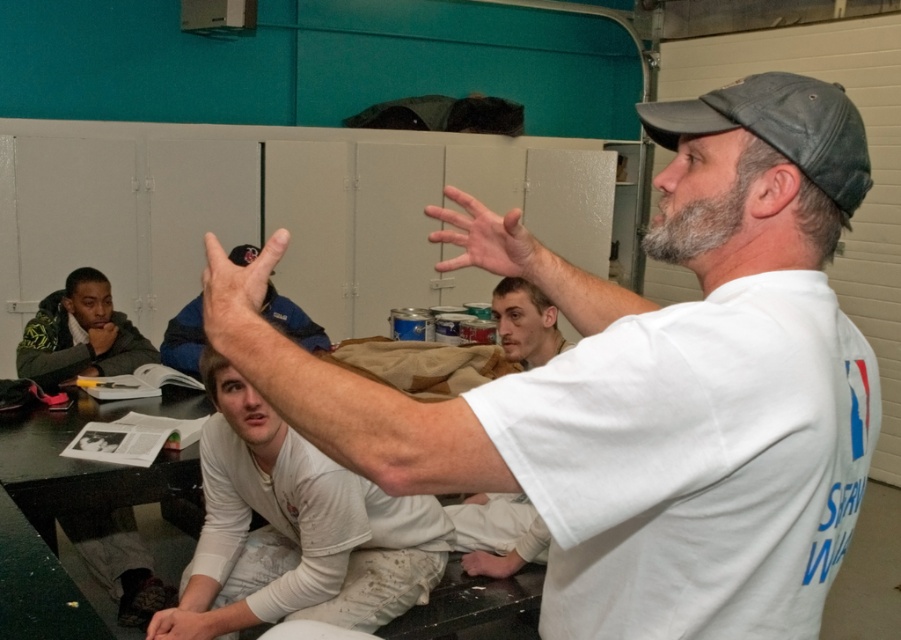
Question: Does white cotton shirt at upper right have a smaller size compared to smooth skin hand at lower left?

Choices:
 (A) no
 (B) yes

Answer: (A)

Question: Is white matte shirt at lower center positioned before matte skin hand at center?

Choices:
 (A) no
 (B) yes

Answer: (A)

Question: Which of the following is the farthest from the observer?

Choices:
 (A) white cotton shirt at upper right
 (B) matte skin hand at center
 (C) matte white hand at center

Answer: (B)

Question: Is dark gray fabric baseball cap at upper right above smooth skin hand at lower left?

Choices:
 (A) no
 (B) yes

Answer: (B)

Question: Which of the following is the closest to the observer?

Choices:
 (A) (247, 301)
 (B) (50, 508)
 (C) (730, 269)
 (D) (108, 326)

Answer: (C)

Question: Among these objects, which one is farthest from the camera?

Choices:
 (A) matte white hand at center
 (B) white matte hand at lower center
 (C) green textured jacket at left
 (D) matte skin hand at center

Answer: (C)